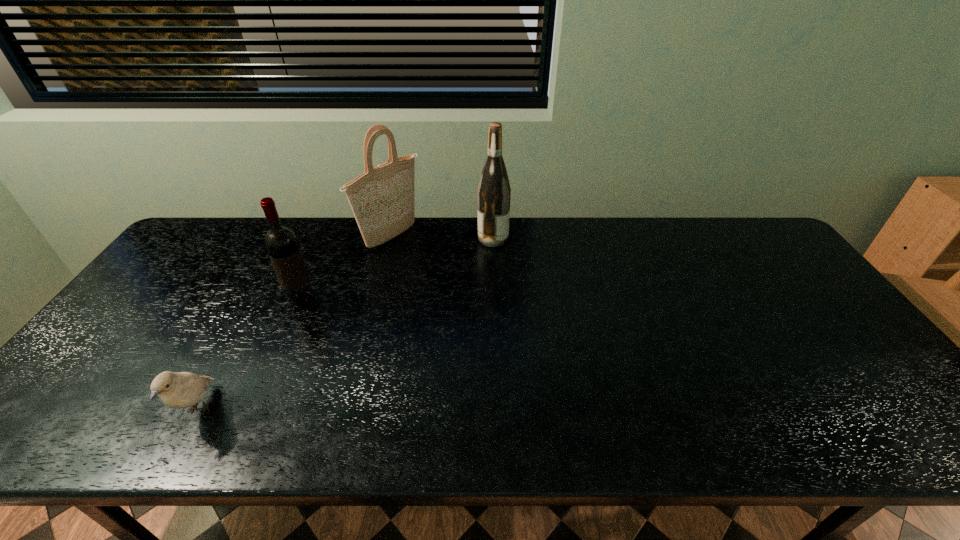
You are a GUI agent. You are given a task and a screenshot of the screen. Output one action in this format:
    pyautogui.click(x=<x>, y=<y>)
    Task: Click on the taller wine bottle
    The height and width of the screenshot is (540, 960).
    Given the screenshot: What is the action you would take?
    pos(493,194)

Find the location of a particular element. the farther wine bottle is located at coordinates (493, 194).

The image size is (960, 540). Find the location of `the third object from left to right`. the third object from left to right is located at coordinates (382, 199).

The height and width of the screenshot is (540, 960). Find the location of `the nearer wine bottle`. the nearer wine bottle is located at coordinates (281, 243).

Where is `the shorter wine bottle`? The height and width of the screenshot is (540, 960). the shorter wine bottle is located at coordinates (281, 243).

What are the coordinates of `bird` in the screenshot? It's located at (176, 390).

Where is `the leftmost object`? Image resolution: width=960 pixels, height=540 pixels. the leftmost object is located at coordinates (176, 390).

Where is `blank space located on the front of the right wine bottle`? blank space located on the front of the right wine bottle is located at coordinates (494, 279).

The height and width of the screenshot is (540, 960). Identify the location of vacant space located on the right of the shopping bag. (508, 238).

The image size is (960, 540). What are the coordinates of `vacant position located on the left of the third farthest object` in the screenshot? It's located at tap(218, 300).